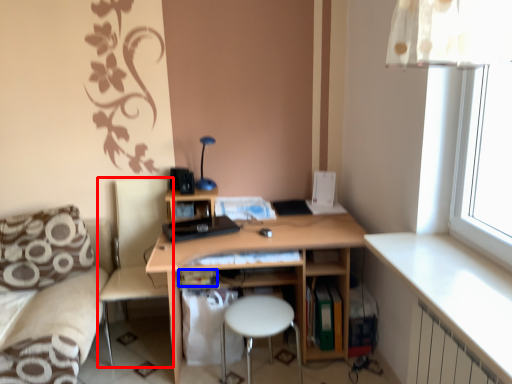
Question: Which point is closer to the camera, swivel chair (highlighted by a red box) or book (highlighted by a blue box)?

Choices:
 (A) swivel chair
 (B) book

Answer: (A)